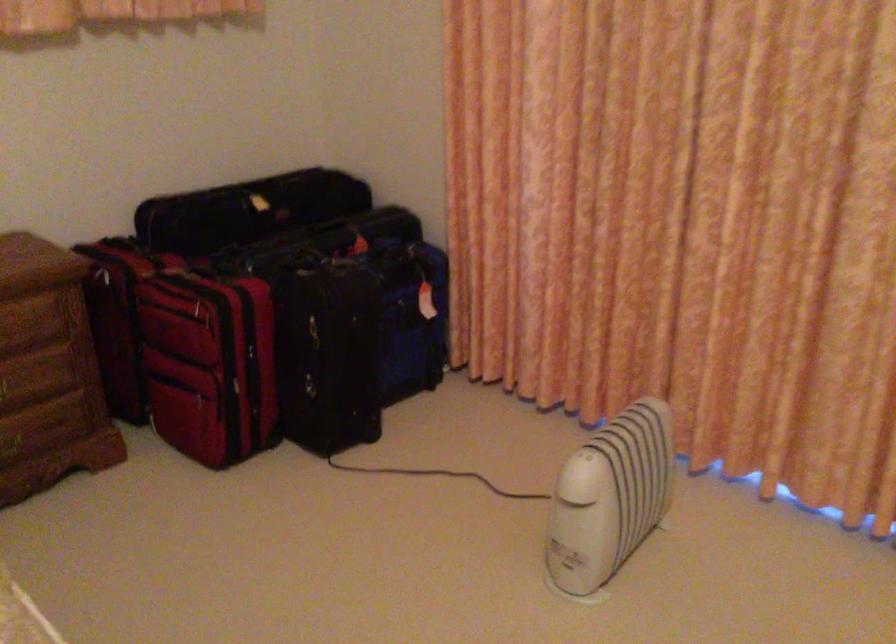
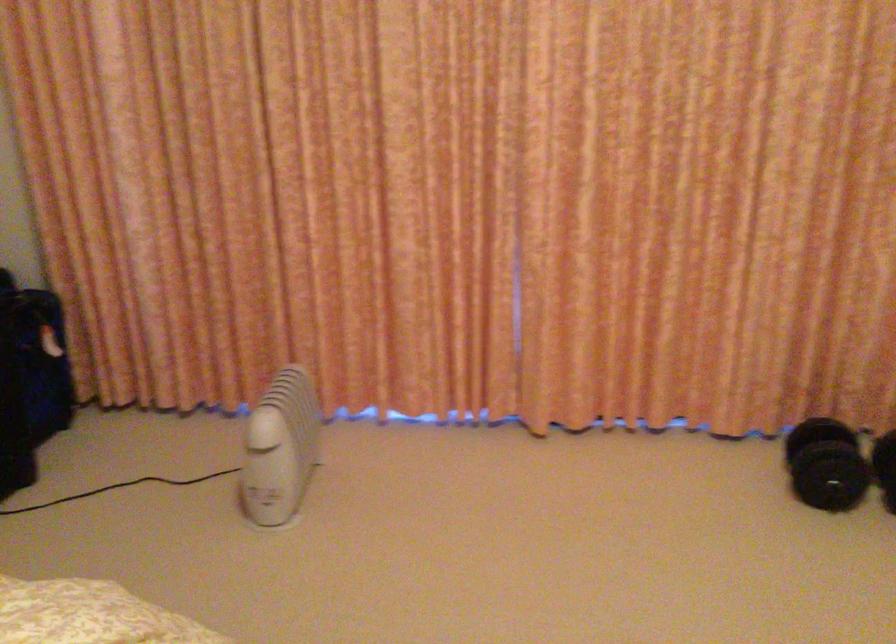
Question: The camera is either moving clockwise (left) or counter-clockwise (right) around the object. The first image is from the beginning of the video and the second image is from the end. Is the camera moving left or right when shooting the video?

Choices:
 (A) Left
 (B) Right

Answer: (A)